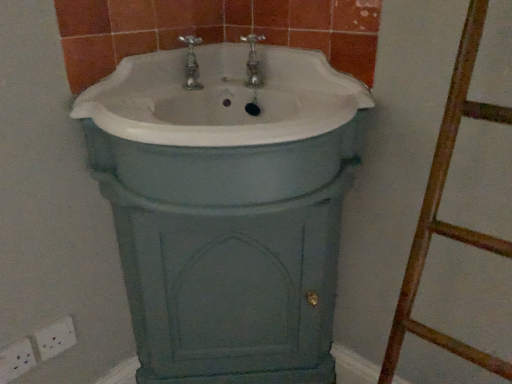
Question: Considering the relative sizes of white plastic electric outlet at lower left, which is the 1th electric outlet in left-to-right order, and white plastic electric outlet at lower left, the 1th electric outlet when ordered from right to left, in the image provided, is white plastic electric outlet at lower left, which is the 1th electric outlet in left-to-right order, wider than white plastic electric outlet at lower left, the 1th electric outlet when ordered from right to left,?

Choices:
 (A) yes
 (B) no

Answer: (A)

Question: From the image's perspective, is white plastic electric outlet at lower left, which is the 2th electric outlet from right to left, beneath white plastic electric outlet at lower left, marked as the 2th electric outlet in a left-to-right arrangement?

Choices:
 (A) yes
 (B) no

Answer: (A)

Question: Is white plastic electric outlet at lower left, which is the 1th electric outlet in left-to-right order, taller than white plastic electric outlet at lower left, marked as the 2th electric outlet in a left-to-right arrangement?

Choices:
 (A) yes
 (B) no

Answer: (B)

Question: From a real-world perspective, does white plastic electric outlet at lower left, which is the 1th electric outlet in left-to-right order, stand above white plastic electric outlet at lower left, the 1th electric outlet when ordered from right to left?

Choices:
 (A) no
 (B) yes

Answer: (A)

Question: Can you confirm if white plastic electric outlet at lower left, which is the 1th electric outlet in left-to-right order, is bigger than white plastic electric outlet at lower left, the 1th electric outlet when ordered from right to left?

Choices:
 (A) yes
 (B) no

Answer: (A)

Question: Looking at their shapes, would you say white ceramic sink at center is wider or thinner than white plastic electric outlet at lower left, which is the 1th electric outlet in left-to-right order?

Choices:
 (A) thin
 (B) wide

Answer: (B)

Question: Do you think white ceramic sink at center is within white plastic electric outlet at lower left, which is the 2th electric outlet from right to left, or outside of it?

Choices:
 (A) inside
 (B) outside

Answer: (B)

Question: From the image's perspective, is white ceramic sink at center positioned above or below white plastic electric outlet at lower left, which is the 1th electric outlet in left-to-right order?

Choices:
 (A) below
 (B) above

Answer: (B)

Question: From a real-world perspective, is white ceramic sink at center above or below white plastic electric outlet at lower left, which is the 2th electric outlet from right to left?

Choices:
 (A) below
 (B) above

Answer: (B)

Question: Relative to white plastic electric outlet at lower left, the 1th electric outlet when ordered from right to left, is white ceramic sink at center in front or behind?

Choices:
 (A) behind
 (B) front

Answer: (B)

Question: Does point pyautogui.click(x=352, y=92) appear closer or farther from the camera than point pyautogui.click(x=49, y=349)?

Choices:
 (A) farther
 (B) closer

Answer: (B)

Question: Looking at the image, does white ceramic sink at center seem bigger or smaller compared to white plastic electric outlet at lower left, marked as the 2th electric outlet in a left-to-right arrangement?

Choices:
 (A) big
 (B) small

Answer: (A)

Question: Is white ceramic sink at center inside or outside of white plastic electric outlet at lower left, marked as the 2th electric outlet in a left-to-right arrangement?

Choices:
 (A) inside
 (B) outside

Answer: (B)

Question: Is white plastic electric outlet at lower left, which is the 2th electric outlet from right to left, wider or thinner than white plastic electric outlet at lower left, marked as the 2th electric outlet in a left-to-right arrangement?

Choices:
 (A) thin
 (B) wide

Answer: (B)

Question: In the image, is white plastic electric outlet at lower left, which is the 2th electric outlet from right to left, on the left side or the right side of white plastic electric outlet at lower left, the 1th electric outlet when ordered from right to left?

Choices:
 (A) left
 (B) right

Answer: (A)